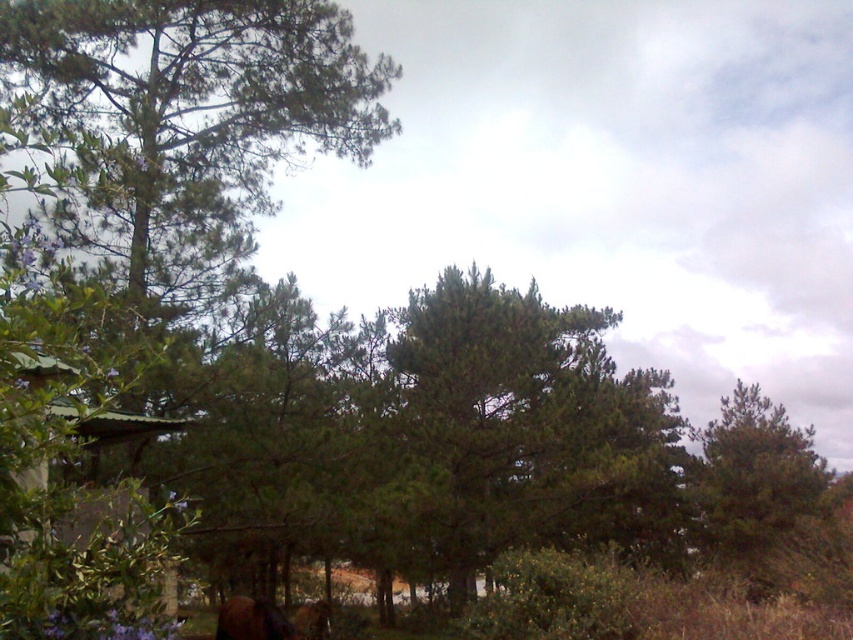
Between point (741, 396) and point (225, 602), which one is positioned in front?

Point (225, 602) is more forward.

The image size is (853, 640). What do you see at coordinates (753, 476) in the screenshot?
I see `green matte tree at center` at bounding box center [753, 476].

Is point (721, 504) less distant than point (271, 634)?

No, it is behind (271, 634).

At what (x,y) coordinates should I click in order to perform the action: click on green matte tree at center. Please return your answer as a coordinate pair (x, y). This screenshot has width=853, height=640. Looking at the image, I should click on (753, 476).

Between green matte tree at center and green corrugated metal hut at lower left, which one appears on the left side from the viewer's perspective?

Positioned to the left is green corrugated metal hut at lower left.

Is green matte tree at center thinner than green corrugated metal hut at lower left?

In fact, green matte tree at center might be wider than green corrugated metal hut at lower left.

At what (x,y) coordinates should I click in order to perform the action: click on green matte tree at center. Please return your answer as a coordinate pair (x, y). This screenshot has height=640, width=853. Looking at the image, I should click on (753, 476).

Identify the location of green matte tree at center. The height and width of the screenshot is (640, 853). (753, 476).

Does green corrugated metal hut at lower left appear on the right side of brown fuzzy horse at lower left?

Correct, you'll find green corrugated metal hut at lower left to the right of brown fuzzy horse at lower left.

Is point (100, 442) in front of point (233, 605)?

Yes, it is in front of point (233, 605).

You are a GUI agent. You are given a task and a screenshot of the screen. Output one action in this format:
    pyautogui.click(x=<x>, y=<y>)
    Task: Click on the green corrugated metal hut at lower left
    
    Given the screenshot: What is the action you would take?
    pyautogui.click(x=109, y=531)